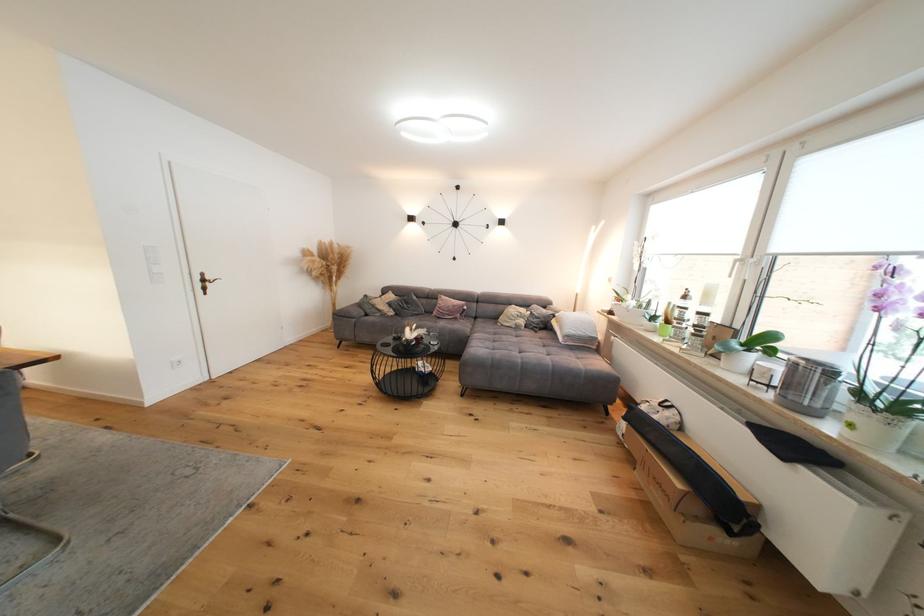
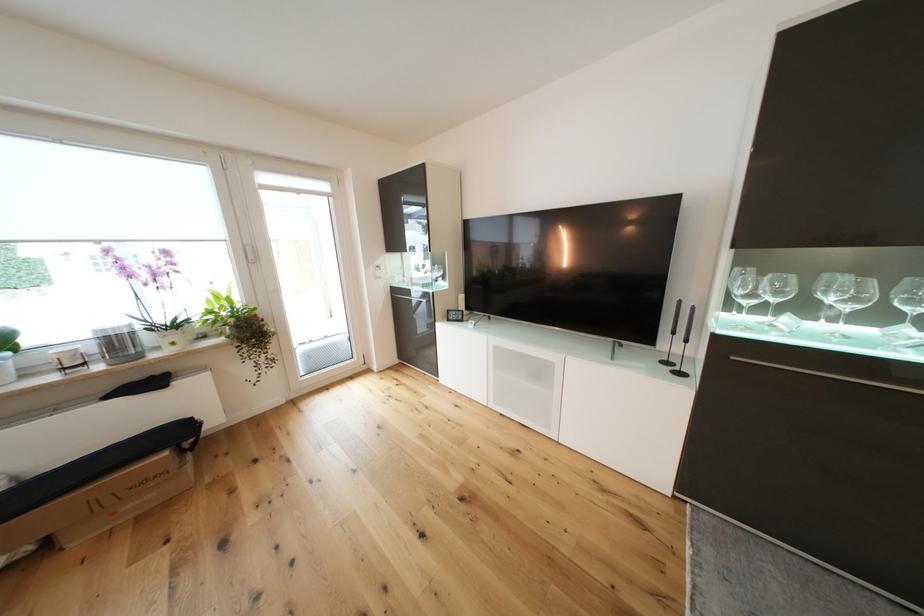
Locate, in the second image, the point that corresponds to (x=687, y=488) in the first image.

(172, 455)